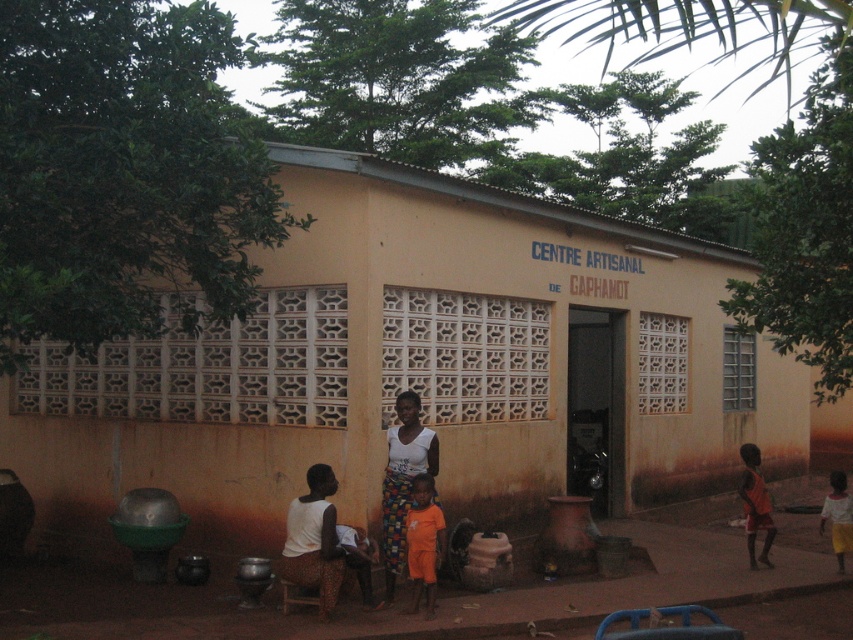
Question: Which of the following is the farthest from the observer?

Choices:
 (A) yellow cotton dress at lower right
 (B) yellow matte building at center
 (C) orange cotton shirt at lower center
 (D) orange fabric at center

Answer: (A)

Question: Where is orange fabric child at lower right located in relation to orange cotton shirt at lower center in the image?

Choices:
 (A) left
 (B) right

Answer: (B)

Question: Does yellow matte building at center lie behind yellow cotton dress at lower right?

Choices:
 (A) no
 (B) yes

Answer: (A)

Question: Which point is farther to the camera?

Choices:
 (A) (833, 525)
 (B) (352, 532)
 (C) (410, 566)

Answer: (A)

Question: Can you confirm if yellow matte building at center is wider than yellow cotton dress at lower right?

Choices:
 (A) no
 (B) yes

Answer: (B)

Question: Which of the following is the farthest from the observer?

Choices:
 (A) orange fabric at center
 (B) white cotton shirt at center

Answer: (B)